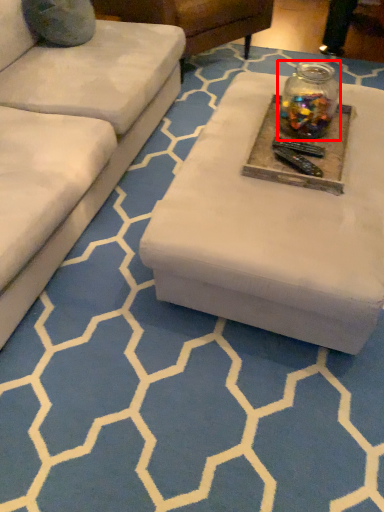
Question: Where is glass jar (annotated by the red box) located in relation to round table in the image?

Choices:
 (A) left
 (B) right

Answer: (B)